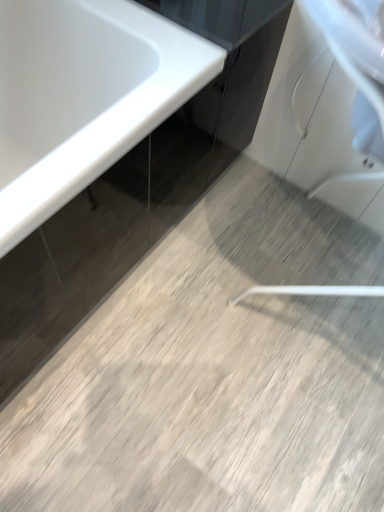
Find the location of `glossy black cabinet at upper center`. glossy black cabinet at upper center is located at coordinates [x=220, y=17].

What do you see at coordinates (220, 17) in the screenshot? I see `glossy black cabinet at upper center` at bounding box center [220, 17].

Measure the distance between point (x=39, y=91) and camera.

Point (x=39, y=91) and camera are 3.87 feet apart.

This screenshot has height=512, width=384. Describe the element at coordinates (83, 96) in the screenshot. I see `white glossy bathtub at upper left` at that location.

The height and width of the screenshot is (512, 384). I want to click on white glossy bathtub at upper left, so click(x=83, y=96).

The height and width of the screenshot is (512, 384). I want to click on glossy black cabinet at upper center, so pyautogui.click(x=220, y=17).

In the image, is white glossy bathtub at upper left on the left side or the right side of glossy black cabinet at upper center?

white glossy bathtub at upper left is to the left of glossy black cabinet at upper center.

Considering the relative positions of white glossy bathtub at upper left and glossy black cabinet at upper center in the image provided, is white glossy bathtub at upper left behind glossy black cabinet at upper center?

No.

Considering the positions of point (54, 77) and point (235, 42), is point (54, 77) closer or farther from the camera than point (235, 42)?

Point (54, 77).

From the image's perspective, does white glossy bathtub at upper left appear lower than glossy black cabinet at upper center?

Yes, from the image's perspective, white glossy bathtub at upper left is beneath glossy black cabinet at upper center.

From a real-world perspective, which object stands above the other?

glossy black cabinet at upper center.

Considering the relative sizes of white glossy bathtub at upper left and glossy black cabinet at upper center in the image provided, is white glossy bathtub at upper left thinner than glossy black cabinet at upper center?

In fact, white glossy bathtub at upper left might be wider than glossy black cabinet at upper center.

Is white glossy bathtub at upper left taller than glossy black cabinet at upper center?

Yes.

In terms of size, does white glossy bathtub at upper left appear bigger or smaller than glossy black cabinet at upper center?

In the image, white glossy bathtub at upper left appears to be larger than glossy black cabinet at upper center.

Is white glossy bathtub at upper left situated inside glossy black cabinet at upper center or outside?

white glossy bathtub at upper left is not enclosed by glossy black cabinet at upper center.

Is white glossy bathtub at upper left far from glossy black cabinet at upper center?

That's not correct — white glossy bathtub at upper left is a little close to glossy black cabinet at upper center.

Does white glossy bathtub at upper left turn towards glossy black cabinet at upper center?

No, white glossy bathtub at upper left is not oriented towards glossy black cabinet at upper center.

Can you tell me how much white glossy bathtub at upper left and glossy black cabinet at upper center differ in facing direction?

The angular difference between white glossy bathtub at upper left and glossy black cabinet at upper center is 0.0367 degrees.

Measure the distance from white glossy bathtub at upper left to glossy black cabinet at upper center.

9.93 inches.

In the image, there is a white glossy bathtub at upper left. Where is `cabinetry above it (from the image's perspective)`? cabinetry above it (from the image's perspective) is located at coordinates (220, 17).

Considering the relative positions of glossy black cabinet at upper center and white glossy bathtub at upper left in the image provided, is glossy black cabinet at upper center to the left of white glossy bathtub at upper left from the viewer's perspective?

Incorrect, glossy black cabinet at upper center is not on the left side of white glossy bathtub at upper left.

Is the depth of glossy black cabinet at upper center greater than that of white glossy bathtub at upper left?

Yes, it is.

Is point (225, 0) closer or farther from the camera than point (43, 187)?

Point (225, 0) appears to be farther away from the viewer than point (43, 187).

Based on the photo, from the image's perspective, does glossy black cabinet at upper center appear higher than white glossy bathtub at upper left?

Yes, from the image's perspective, glossy black cabinet at upper center is on top of white glossy bathtub at upper left.

From a real-world perspective, is glossy black cabinet at upper center physically above white glossy bathtub at upper left?

Indeed, from a real-world perspective, glossy black cabinet at upper center stands above white glossy bathtub at upper left.

Which of these two, glossy black cabinet at upper center or white glossy bathtub at upper left, is wider?

With larger width is white glossy bathtub at upper left.

Considering the sizes of objects glossy black cabinet at upper center and white glossy bathtub at upper left in the image provided, who is shorter, glossy black cabinet at upper center or white glossy bathtub at upper left?

Standing shorter between the two is glossy black cabinet at upper center.

Looking at this image, considering the sizes of objects glossy black cabinet at upper center and white glossy bathtub at upper left in the image provided, who is smaller, glossy black cabinet at upper center or white glossy bathtub at upper left?

glossy black cabinet at upper center is smaller.

Could white glossy bathtub at upper left be considered to be inside glossy black cabinet at upper center?

No, white glossy bathtub at upper left is not inside glossy black cabinet at upper center.

Is glossy black cabinet at upper center positioned far away from white glossy bathtub at upper left?

glossy black cabinet at upper center is near white glossy bathtub at upper left, not far away.

In the scene shown: Could you tell me if glossy black cabinet at upper center is turned towards white glossy bathtub at upper left?

No, glossy black cabinet at upper center is not oriented towards white glossy bathtub at upper left.

How different are the orientations of glossy black cabinet at upper center and white glossy bathtub at upper left in degrees?

There is a 0.0367-degree angle between the facing directions of glossy black cabinet at upper center and white glossy bathtub at upper left.

Where is `cabinetry to the right of white glossy bathtub at upper left`? cabinetry to the right of white glossy bathtub at upper left is located at coordinates (220, 17).

This screenshot has width=384, height=512. Identify the location of bathtub below the glossy black cabinet at upper center (from the image's perspective). (83, 96).

This screenshot has width=384, height=512. I want to click on cabinetry lying on the right of white glossy bathtub at upper left, so click(x=220, y=17).